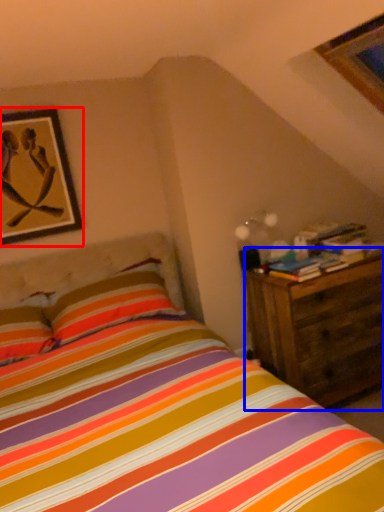
Question: Which object appears closest to the camera in this image, picture frame (highlighted by a red box) or nightstand (highlighted by a blue box)?

Choices:
 (A) picture frame
 (B) nightstand

Answer: (B)